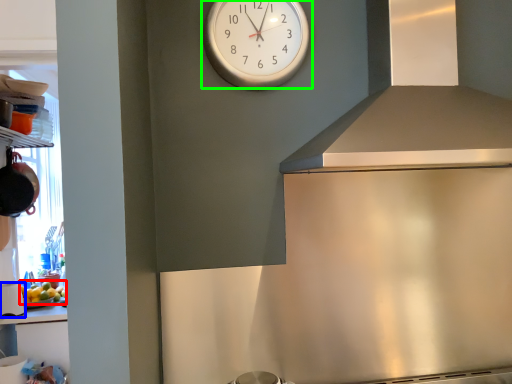
Question: Estimate the real-world distances between objects in this image. Which object is farther from food (highlighted by a red box), appliance (highlighted by a blue box) or wall clock (highlighted by a green box)?

Choices:
 (A) appliance
 (B) wall clock

Answer: (B)